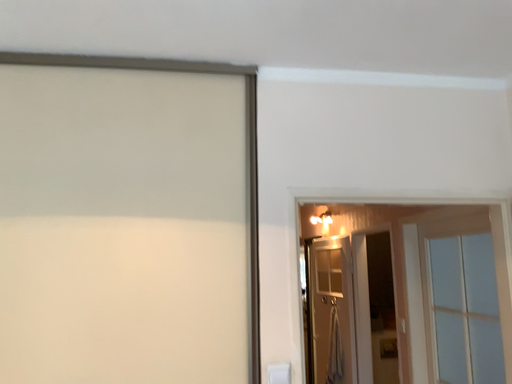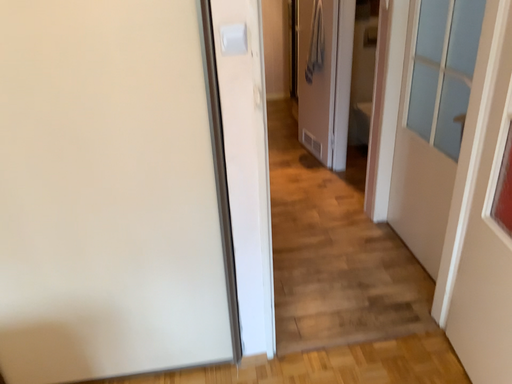
Question: How did the camera likely rotate when shooting the video?

Choices:
 (A) rotated downward
 (B) rotated upward

Answer: (A)